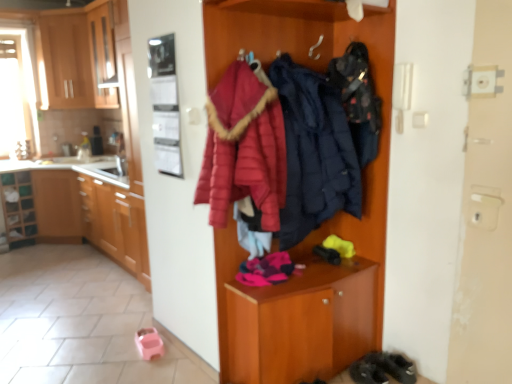
Question: Does wooden cabinet at center lie in front of matte wood cabinets at left, the 3th cabinetry in the top-to-bottom sequence?

Choices:
 (A) yes
 (B) no

Answer: (A)

Question: Considering the relative positions of wooden cabinet at center and matte wood cabinets at left, the 3th cabinetry in the top-to-bottom sequence, in the image provided, is wooden cabinet at center to the left of matte wood cabinets at left, the 3th cabinetry in the top-to-bottom sequence, from the viewer's perspective?

Choices:
 (A) yes
 (B) no

Answer: (B)

Question: From a real-world perspective, is wooden cabinet at center on matte wood cabinets at left, the 3th cabinetry in the top-to-bottom sequence?

Choices:
 (A) no
 (B) yes

Answer: (B)

Question: Is wooden cabinet at center wider than matte wood cabinets at left, the 1th cabinetry in the bottom-to-top sequence?

Choices:
 (A) no
 (B) yes

Answer: (A)

Question: Is wooden cabinet at center in contact with matte wood cabinets at left, the 3th cabinetry in the top-to-bottom sequence?

Choices:
 (A) no
 (B) yes

Answer: (A)

Question: From the image's perspective, is wooden cabinet at center beneath matte wood cabinets at left, the 1th cabinetry in the bottom-to-top sequence?

Choices:
 (A) no
 (B) yes

Answer: (A)

Question: Does wooden shelf at left appear on the left side of dark blue quilted jacket at center, the first clothing from the right?

Choices:
 (A) yes
 (B) no

Answer: (A)

Question: Can you confirm if wooden shelf at left is positioned to the right of dark blue quilted jacket at center, the second clothing positioned from the left?

Choices:
 (A) yes
 (B) no

Answer: (B)

Question: Is wooden shelf at left directly adjacent to dark blue quilted jacket at center, the second clothing positioned from the left?

Choices:
 (A) yes
 (B) no

Answer: (B)

Question: Considering the relative sizes of wooden shelf at left and dark blue quilted jacket at center, the second clothing positioned from the left, in the image provided, is wooden shelf at left wider than dark blue quilted jacket at center, the second clothing positioned from the left,?

Choices:
 (A) yes
 (B) no

Answer: (A)

Question: From the image's perspective, is wooden shelf at left beneath dark blue quilted jacket at center, the first clothing from the right?

Choices:
 (A) yes
 (B) no

Answer: (A)

Question: Is wooden shelf at left facing away from dark blue quilted jacket at center, the second clothing positioned from the left?

Choices:
 (A) no
 (B) yes

Answer: (A)

Question: From the image's perspective, is wooden cabinets at left, marked as the second cabinetry in a top-to-bottom arrangement, above wooden cabinet at center?

Choices:
 (A) yes
 (B) no

Answer: (B)